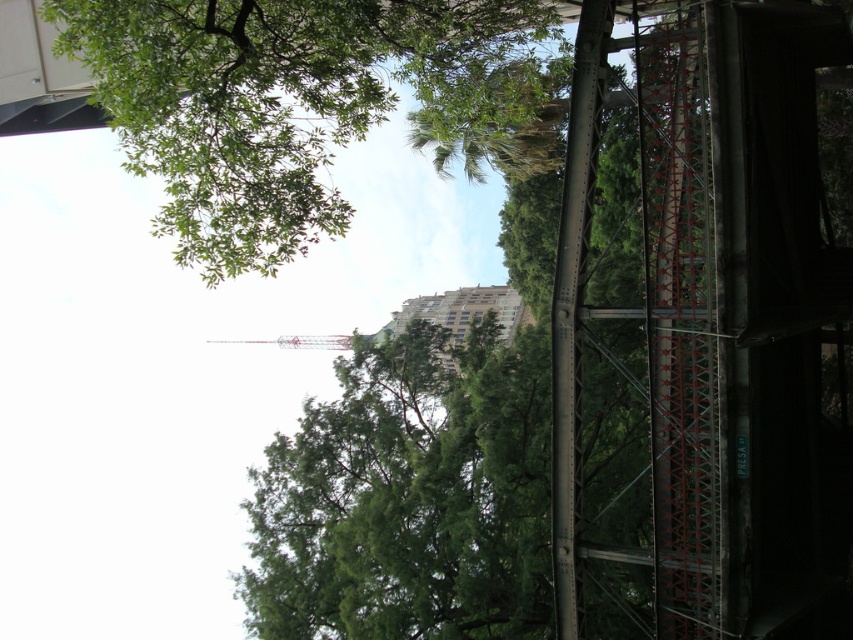
Question: Which object appears farthest from the camera in this image?

Choices:
 (A) green leafy tree at upper left
 (B) metallic pink tower at center

Answer: (B)

Question: Among these points, which one is farthest from the camera?

Choices:
 (A) (242, 109)
 (B) (314, 344)

Answer: (B)

Question: Does green leafy tree at upper left appear on the right side of metallic pink tower at center?

Choices:
 (A) no
 (B) yes

Answer: (B)

Question: In this image, where is green leafy tree at upper left located relative to metallic pink tower at center?

Choices:
 (A) below
 (B) above

Answer: (B)

Question: Does green leafy tree at upper left have a greater width compared to metallic pink tower at center?

Choices:
 (A) no
 (B) yes

Answer: (A)